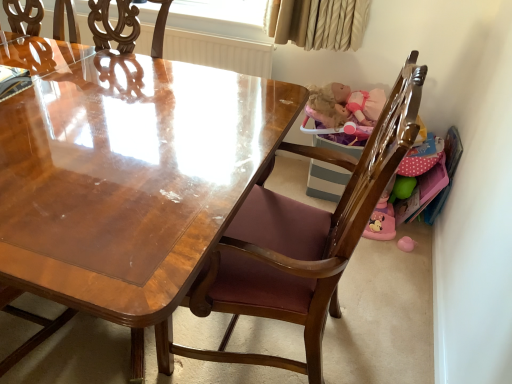
Question: Does point (369, 195) appear closer or farther from the camera than point (226, 14)?

Choices:
 (A) farther
 (B) closer

Answer: (B)

Question: From a real-world perspective, is mahogany wood chair at center physically located above or below transparent plastic window screen at upper center?

Choices:
 (A) above
 (B) below

Answer: (B)

Question: Considering the relative positions of mahogany wood chair at center and transparent plastic window screen at upper center in the image provided, is mahogany wood chair at center to the left or to the right of transparent plastic window screen at upper center?

Choices:
 (A) left
 (B) right

Answer: (B)

Question: From the image's perspective, is transparent plastic window screen at upper center above or below mahogany wood chair at center?

Choices:
 (A) below
 (B) above

Answer: (B)

Question: Considering the positions of transparent plastic window screen at upper center and mahogany wood chair at center in the image, is transparent plastic window screen at upper center wider or thinner than mahogany wood chair at center?

Choices:
 (A) thin
 (B) wide

Answer: (A)

Question: Relative to mahogany wood chair at center, is transparent plastic window screen at upper center in front or behind?

Choices:
 (A) front
 (B) behind

Answer: (B)

Question: Visually, is transparent plastic window screen at upper center positioned to the left or to the right of mahogany wood chair at center?

Choices:
 (A) right
 (B) left

Answer: (B)